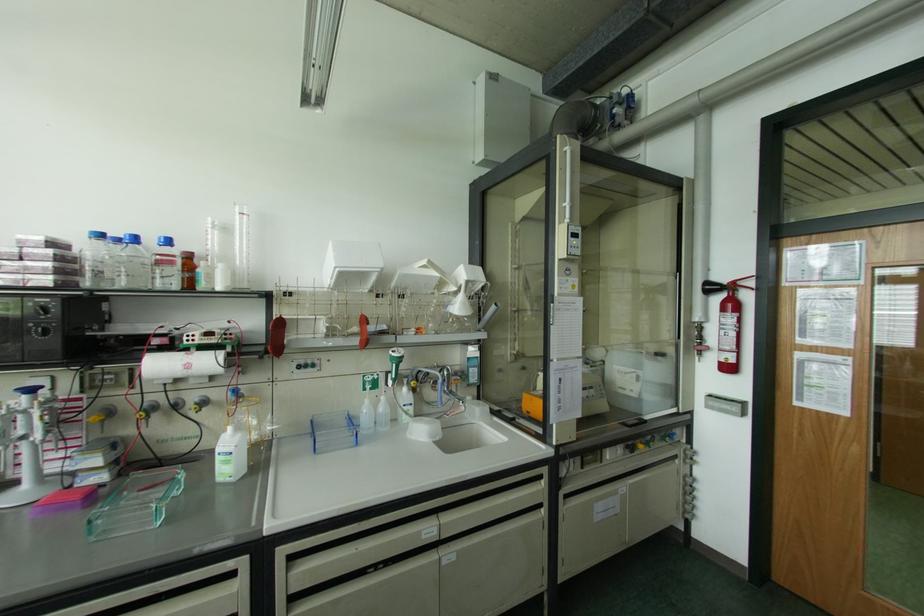
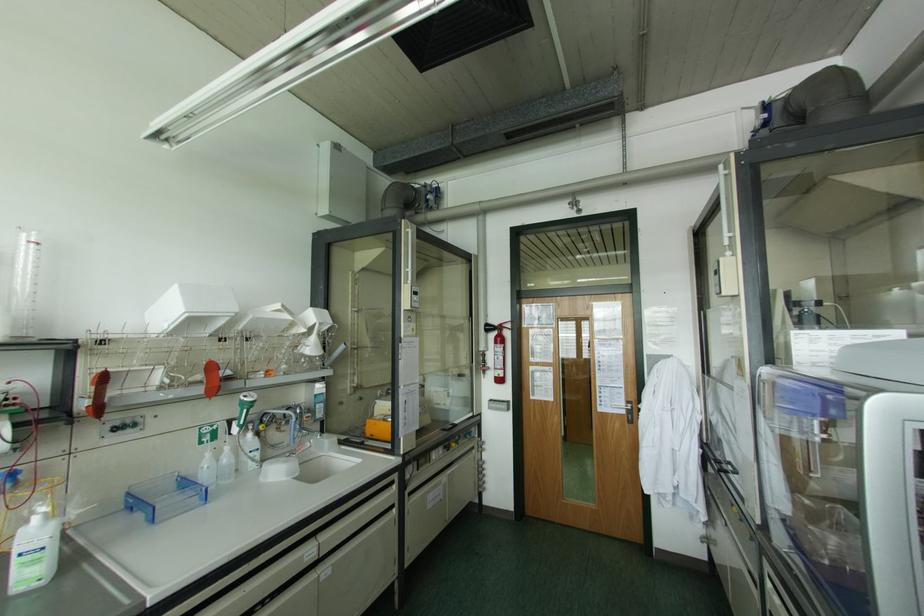
The point at (367, 400) is marked in the first image. Where is the corresponding point in the second image?

(208, 454)